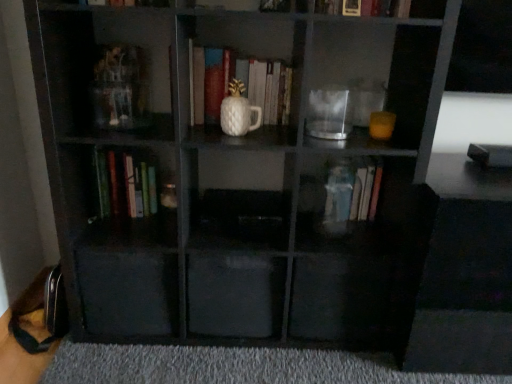
Question: Is there a large distance between transparent plastic drawer at lower left, which is the second drawer from right to left, and transparent glass jar at center?

Choices:
 (A) no
 (B) yes

Answer: (A)

Question: Is transparent plastic drawer at lower left, the 1th drawer when ordered from left to right, facing towards transparent glass jar at center?

Choices:
 (A) no
 (B) yes

Answer: (A)

Question: Is transparent plastic drawer at lower left, which is the second drawer from right to left, bigger than transparent glass jar at center?

Choices:
 (A) no
 (B) yes

Answer: (B)

Question: From a real-world perspective, is transparent plastic drawer at lower left, which is the second drawer from right to left, under transparent glass jar at center?

Choices:
 (A) no
 (B) yes

Answer: (B)

Question: From the image's perspective, does transparent plastic drawer at lower left, the 1th drawer when ordered from left to right, appear lower than transparent glass jar at center?

Choices:
 (A) yes
 (B) no

Answer: (A)

Question: From the image's perspective, would you say transparent plastic drawer at lower left, which is the second drawer from right to left, is positioned over transparent glass jar at center?

Choices:
 (A) yes
 (B) no

Answer: (B)

Question: Is transparent plastic book at center, the fourth book from the left, at the right side of gray carpet at lower center?

Choices:
 (A) yes
 (B) no

Answer: (A)

Question: From a real-world perspective, is transparent plastic book at center, the first book positioned from the right, located higher than gray carpet at lower center?

Choices:
 (A) yes
 (B) no

Answer: (A)

Question: Is transparent plastic book at center, the fourth book from the left, in front of gray carpet at lower center?

Choices:
 (A) yes
 (B) no

Answer: (B)

Question: Is transparent plastic book at center, the first book positioned from the right, wider than gray carpet at lower center?

Choices:
 (A) yes
 (B) no

Answer: (B)

Question: Is the position of transparent plastic book at center, the first book positioned from the right, more distant than that of gray carpet at lower center?

Choices:
 (A) no
 (B) yes

Answer: (B)

Question: From the image's perspective, is transparent plastic book at center, the fourth book from the left, located above gray carpet at lower center?

Choices:
 (A) yes
 (B) no

Answer: (A)

Question: Does gray carpet at lower center have a lesser width compared to white matte vase at center, which is the second book from left to right?

Choices:
 (A) no
 (B) yes

Answer: (A)